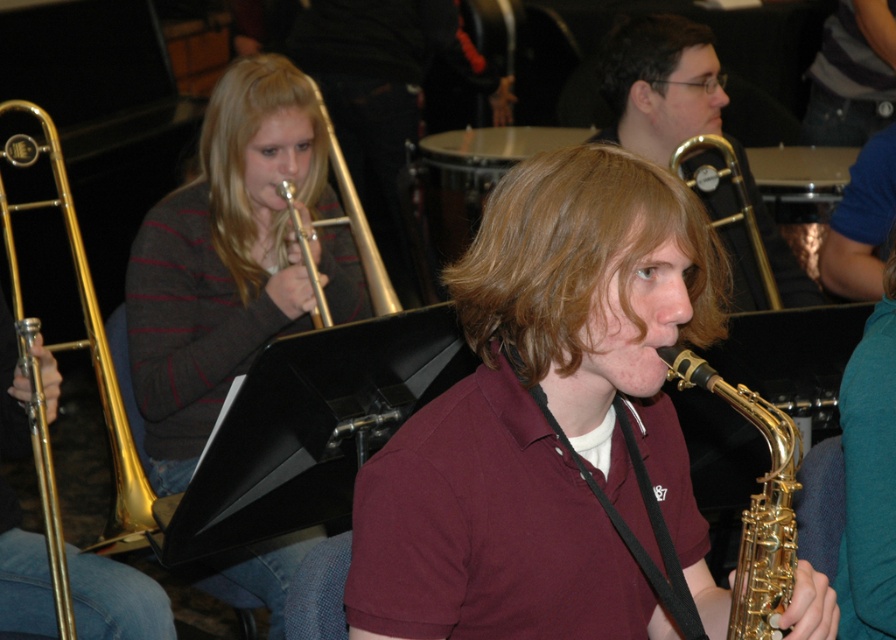
In the scene shown: You are a photographer who wants to capture a closeup of the matte gold trombone at upper center. You are currently positioned at the point with coordinates point (660, 84). Is this the correct location to take the photo?

Yes, because the point (660, 84) corresponds to the matte gold trombone at upper center, so positioning yourself there would allow you to capture a closeup of it.

You are a photographer setting up for a group photo. You need to ensure that the maroon shirt at center and the matte gold trumpet at upper left are both visible in the frame. Given their sizes, which object should you focus on first to ensure both are in focus?

The maroon shirt at center is much taller than the matte gold trumpet at upper left, so focusing on the maroon shirt at center first would ensure both are in focus since it is larger and requires more attention.

You are standing in the music class and want to hand a sheet of music to the person wearing the maroon shirt at center. Based on the coordinates given, in which direction should you walk to reach them?

The maroon shirt at center is located at coordinates point (x=547, y=419). Since the x coordinate is 0.655, which is more than 0.5, you should walk to the right. The y coordinate is 0.612, which is also more than 0.5, so you should walk forward. Therefore, you should walk diagonally forward and to the right to reach the maroon shirt at center.